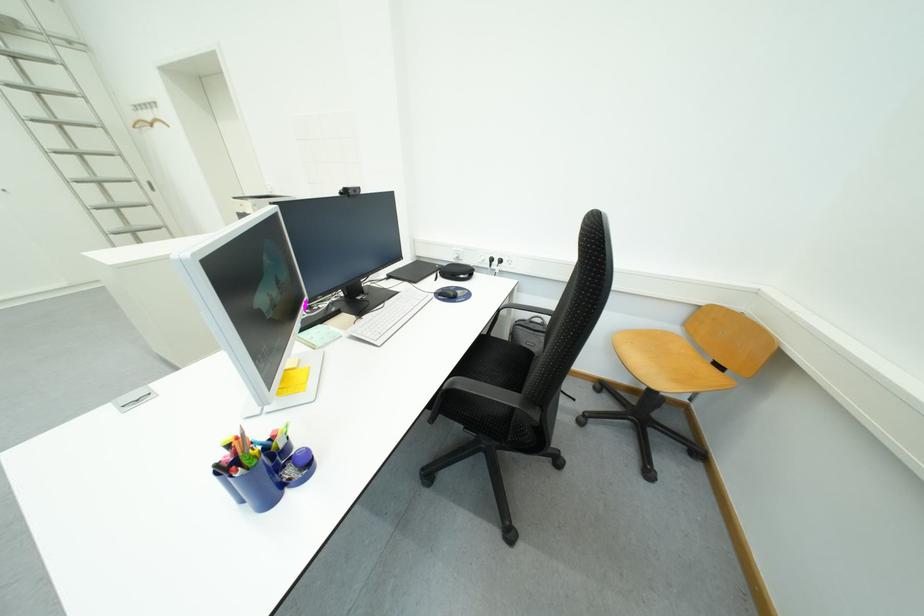
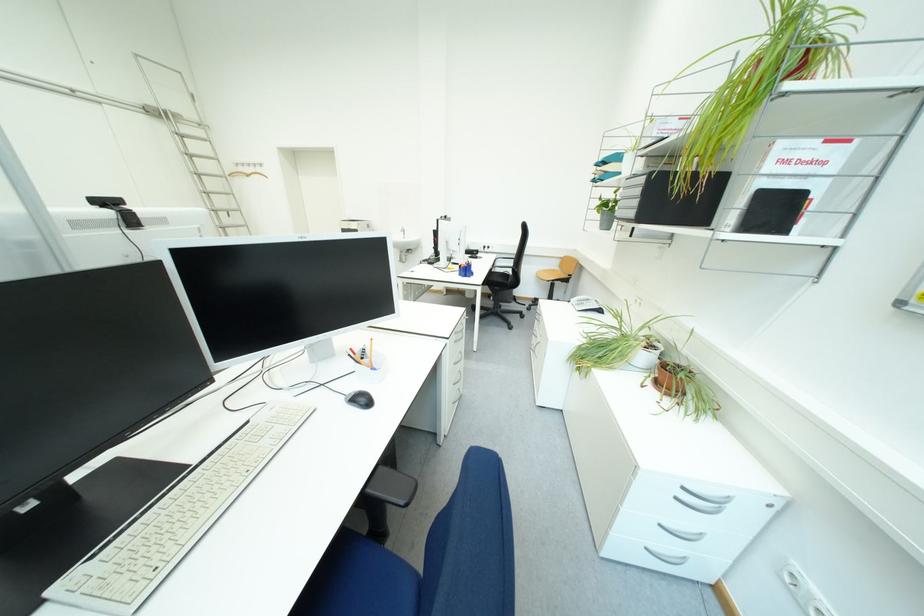
The images are taken continuously from a first-person perspective. In which direction are you moving?

The cameraman moved toward left, backward.